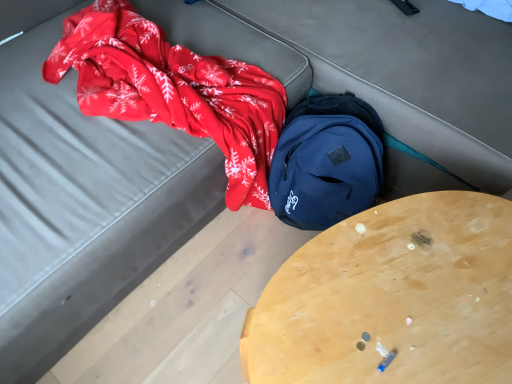
Question: Is navy blue backpack at center outside wooden table at center?

Choices:
 (A) yes
 (B) no

Answer: (A)

Question: Does navy blue backpack at center have a lesser height compared to wooden table at center?

Choices:
 (A) yes
 (B) no

Answer: (A)

Question: Does navy blue backpack at center turn towards wooden table at center?

Choices:
 (A) no
 (B) yes

Answer: (B)

Question: Considering the relative sizes of navy blue backpack at center and wooden table at center in the image provided, is navy blue backpack at center smaller than wooden table at center?

Choices:
 (A) yes
 (B) no

Answer: (A)

Question: Is navy blue backpack at center in contact with wooden table at center?

Choices:
 (A) no
 (B) yes

Answer: (A)

Question: From the image's perspective, would you say navy blue backpack at center is shown under wooden table at center?

Choices:
 (A) no
 (B) yes

Answer: (A)

Question: Can you confirm if wooden table at center is smaller than navy blue backpack at center?

Choices:
 (A) no
 (B) yes

Answer: (A)

Question: Can you confirm if wooden table at center is bigger than navy blue backpack at center?

Choices:
 (A) no
 (B) yes

Answer: (B)

Question: From the image's perspective, is wooden table at center under navy blue backpack at center?

Choices:
 (A) no
 (B) yes

Answer: (B)

Question: Does wooden table at center have a lesser width compared to navy blue backpack at center?

Choices:
 (A) yes
 (B) no

Answer: (B)

Question: Is wooden table at center in front of navy blue backpack at center?

Choices:
 (A) yes
 (B) no

Answer: (A)

Question: From a real-world perspective, is wooden table at center under navy blue backpack at center?

Choices:
 (A) yes
 (B) no

Answer: (B)

Question: From a real-world perspective, is navy blue backpack at center above or below wooden table at center?

Choices:
 (A) above
 (B) below

Answer: (B)